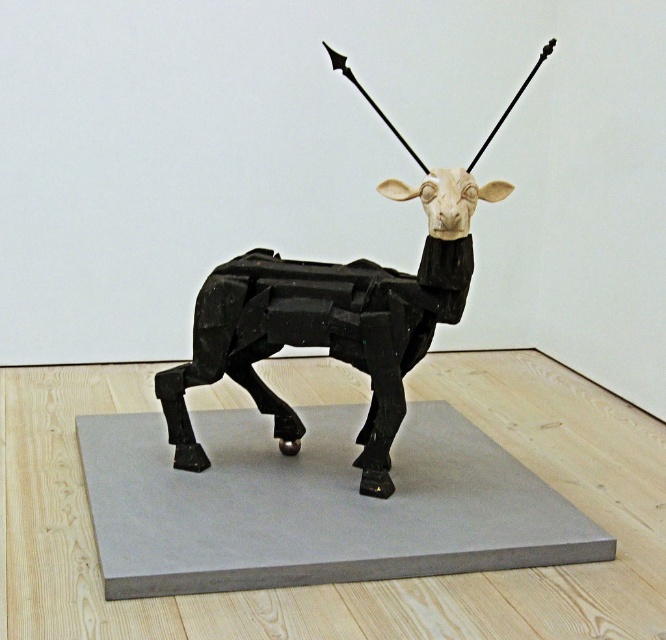
You are an art curator arranging a gallery layout. You have a gray matte platform at center and a matte black sculpture at center in your current exhibit. Which object is located to the left of the other?

The gray matte platform at center is positioned on the left side of matte black sculpture at center.

You are an art curator examining the sculpture. You notice two points marked on the sculpture. The first point is at coordinate (326, 472) and the second is at (406, 362). From your vantage point, which point is closer to you?

Point (406, 362) is closer to you because it is in front of point (326, 472) according to their spatial arrangement.